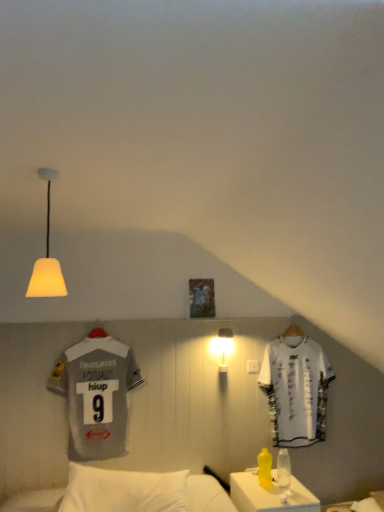
Locate an element on the screen. This screenshot has width=384, height=512. free location above white plastic table at lower right (from a real-world perspective) is located at coordinates (277, 485).